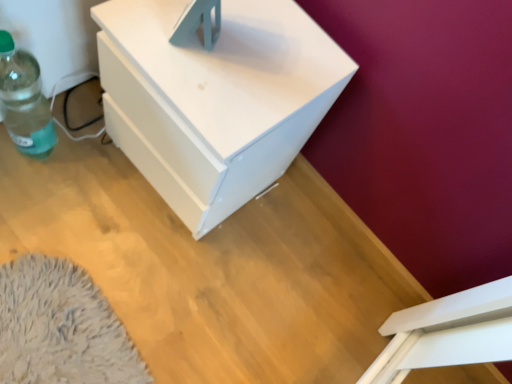
This screenshot has width=512, height=384. I want to click on free space to the right of white matte nightstand at center, so click(x=281, y=258).